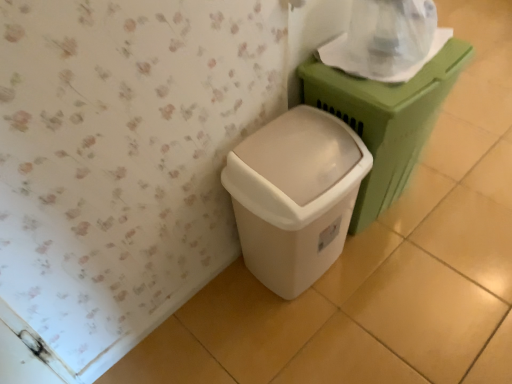
Question: Which is correct: transparent plastic toilet paper at upper right is inside matte green plastic at right, positioned as the 1th waste container in right-to-left order, or outside of it?

Choices:
 (A) outside
 (B) inside

Answer: (B)

Question: Is point (413, 18) closer or farther from the camera than point (403, 107)?

Choices:
 (A) farther
 (B) closer

Answer: (A)

Question: Which of these objects is positioned closest to the white plastic waste container at lower center, the second waste container viewed from the right?

Choices:
 (A) matte green plastic at right, the 2th waste container from the left
 (B) transparent plastic toilet paper at upper right

Answer: (A)

Question: Which object is positioned closest to the white plastic waste container at lower center, arranged as the first waste container when viewed from the left?

Choices:
 (A) matte green plastic at right, the 2th waste container from the left
 (B) transparent plastic toilet paper at upper right

Answer: (A)